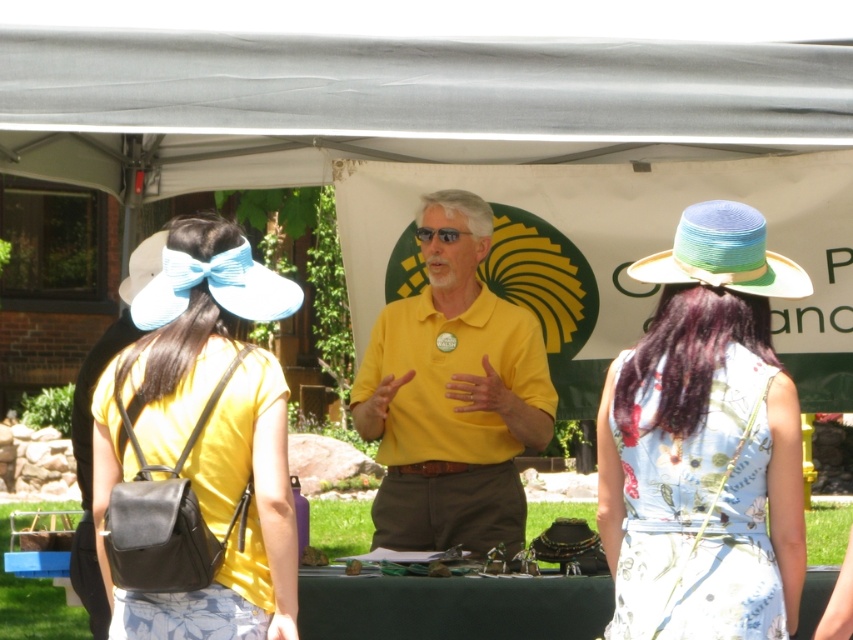
You are at a community event under a large canopy tent. You see a man in a bright yellow polo shirt and brown trousers standing at the center. There is also a point marked at coordinates (704, 442). What object is located at that point?

The point at coordinates (704, 442) corresponds to the floral cotton dress at center.

You are attending a community event and need to locate the speaker who is wearing a yellow matte shirt at center. Where would you look relative to the matte black backpack at left?

The matte black backpack at left is below the yellow matte shirt at center, so you should look above the matte black backpack at left to find the speaker wearing the yellow matte shirt at center.